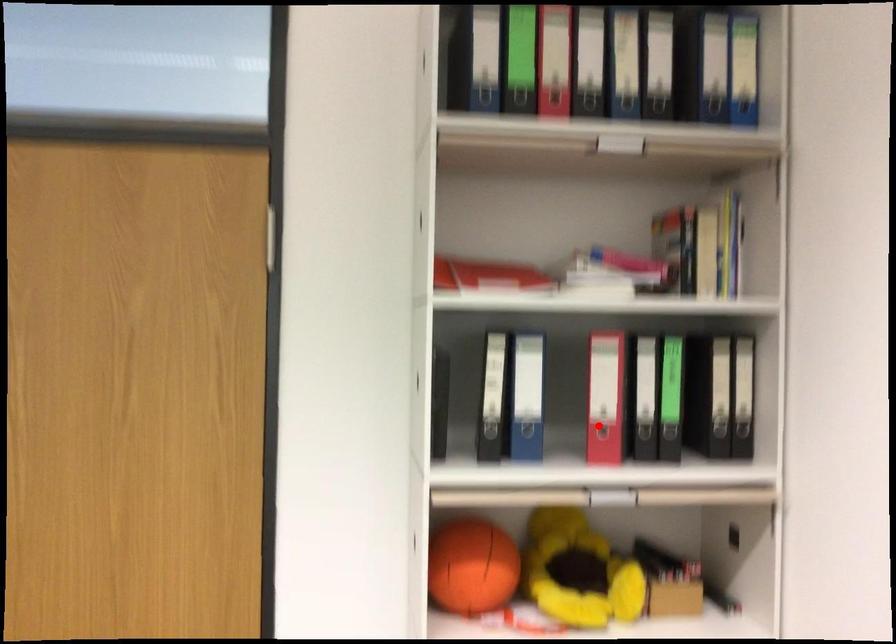
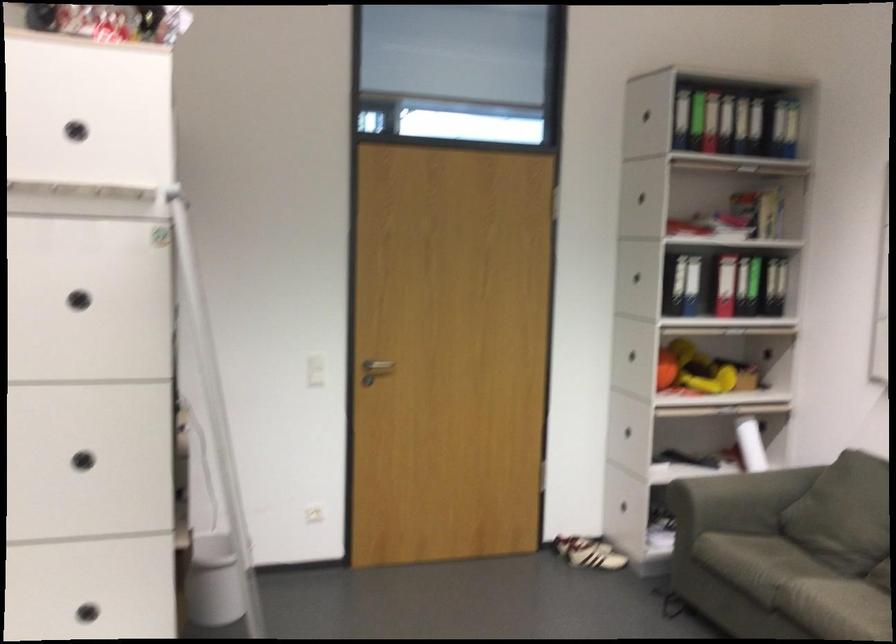
In the second image, find the point that corresponds to the highlighted location in the first image.

(725, 285)